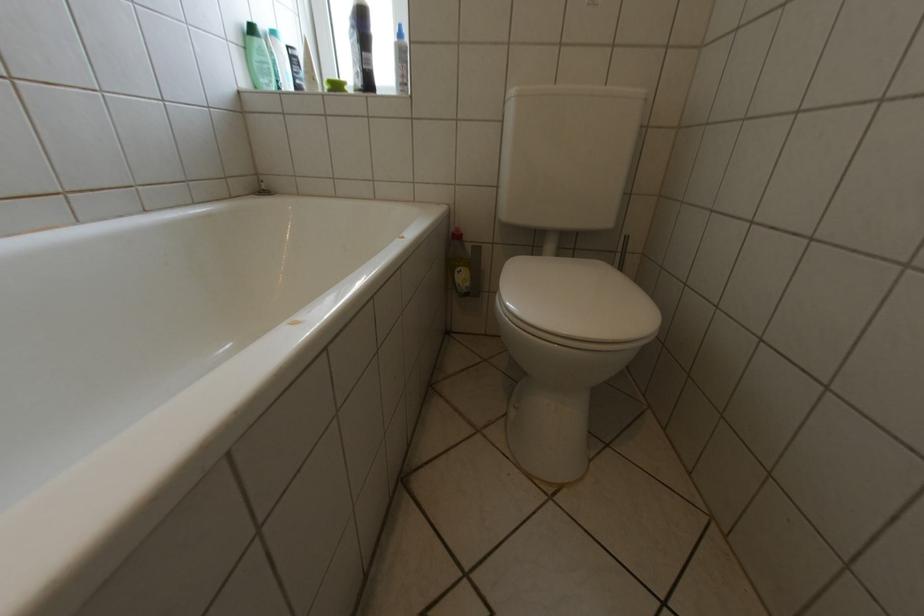
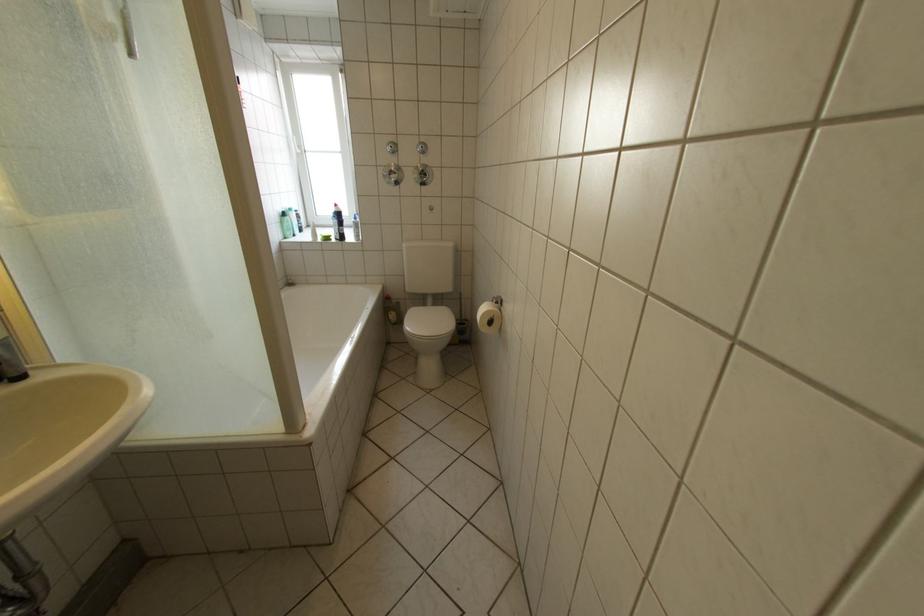
Find the pixel in the second image that matches the point at 468,274 in the first image.

(402, 315)